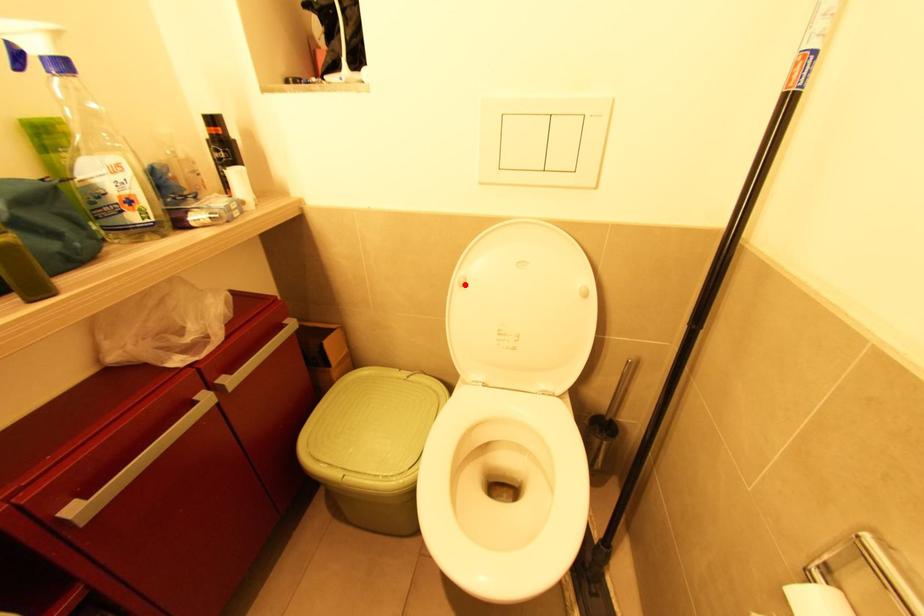
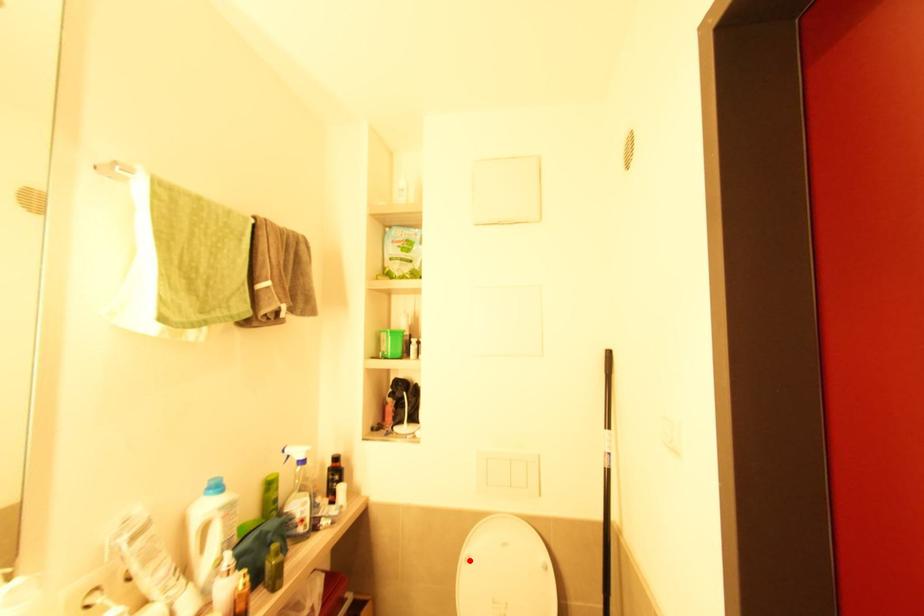
I am providing you with two images of the same scene from different viewpoints. A red point is marked on the first image and another point is marked on the second image. Are the points marked in image1 and image2 representing the same 3D position?

Yes